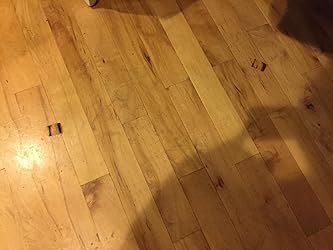
Locate an element on the screen. This screenshot has width=333, height=250. chair or table shadow is located at coordinates (120, 6), (156, 9), (178, 4).